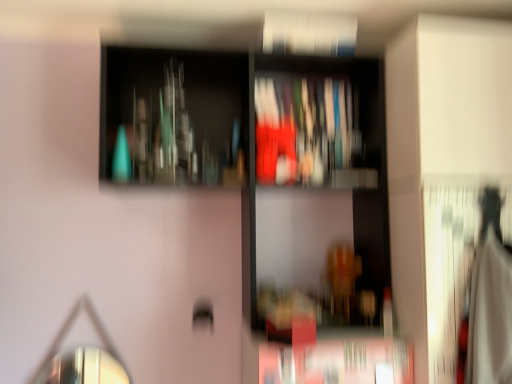
Locate an element on the screen. This screenshot has width=512, height=384. blank space to the left of white paper book at upper center, the 2th book positioned from the bottom is located at coordinates (275, 54).